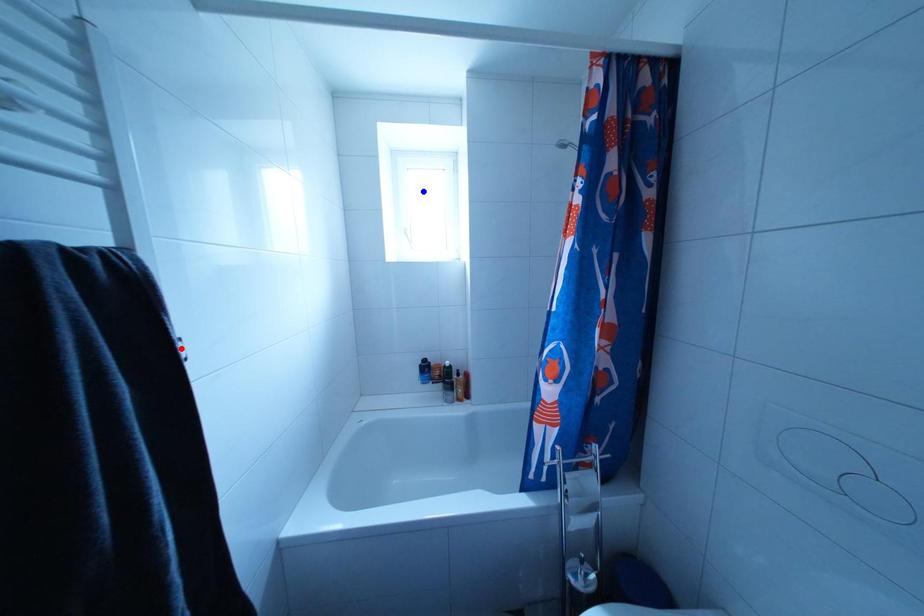
Question: Two points are marked on the image. Which point is closer to the camera?

Choices:
 (A) Blue point is closer.
 (B) Red point is closer.

Answer: (B)